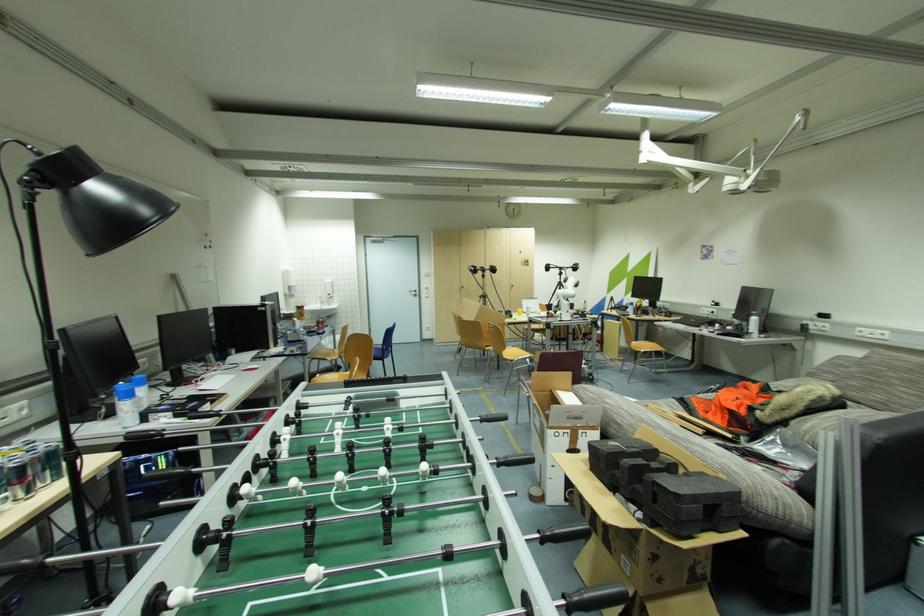
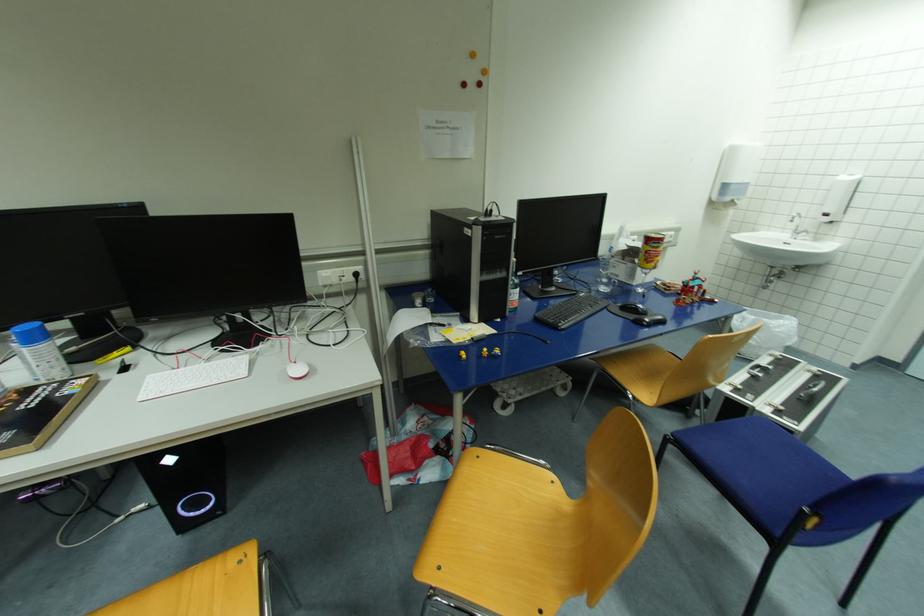
Locate, in the second image, the point that corresponds to point 323,321 in the first image.

(696, 285)